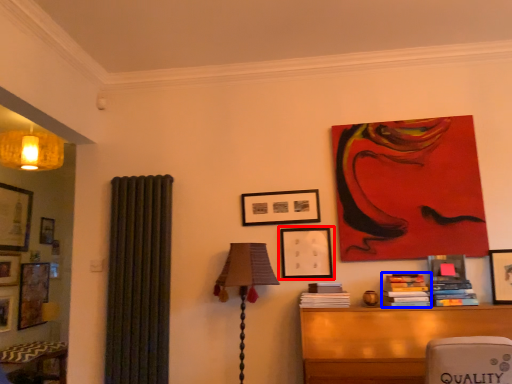
Question: Which object is closer to the camera taking this photo, picture frame (highlighted by a red box) or book (highlighted by a blue box)?

Choices:
 (A) picture frame
 (B) book

Answer: (B)